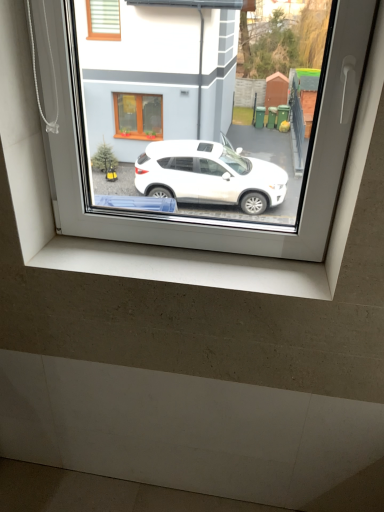
Question: Would you say white concrete window sill at lower center is inside or outside transparent glass window at center?

Choices:
 (A) inside
 (B) outside

Answer: (B)

Question: Is white concrete window sill at lower center bigger or smaller than transparent glass window at center?

Choices:
 (A) big
 (B) small

Answer: (B)

Question: From the image's perspective, is white concrete window sill at lower center located above or below transparent glass window at center?

Choices:
 (A) above
 (B) below

Answer: (B)

Question: From a real-world perspective, is transparent glass window at center positioned above or below white concrete window sill at lower center?

Choices:
 (A) above
 (B) below

Answer: (A)

Question: Is transparent glass window at center bigger or smaller than white concrete window sill at lower center?

Choices:
 (A) big
 (B) small

Answer: (A)

Question: From the image's perspective, is transparent glass window at center above or below white concrete window sill at lower center?

Choices:
 (A) above
 (B) below

Answer: (A)

Question: Would you say transparent glass window at center is to the left or to the right of white concrete window sill at lower center in the picture?

Choices:
 (A) right
 (B) left

Answer: (A)